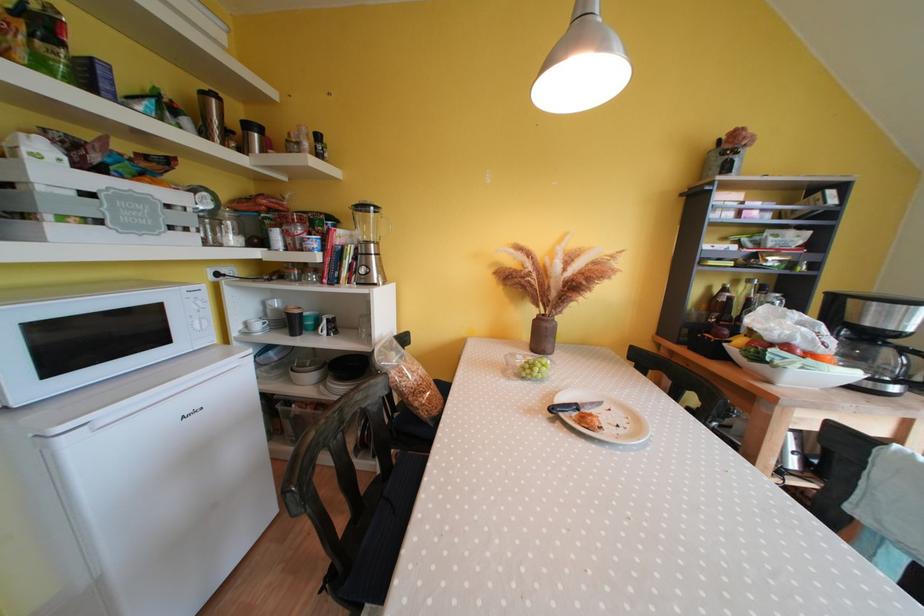
You are a GUI agent. You are given a task and a screenshot of the screen. Output one action in this format:
    pyautogui.click(x=<x>, y=<y>)
    Task: Click on the coffee pot handle
    
    Given the screenshot: What is the action you would take?
    pyautogui.click(x=368, y=244)